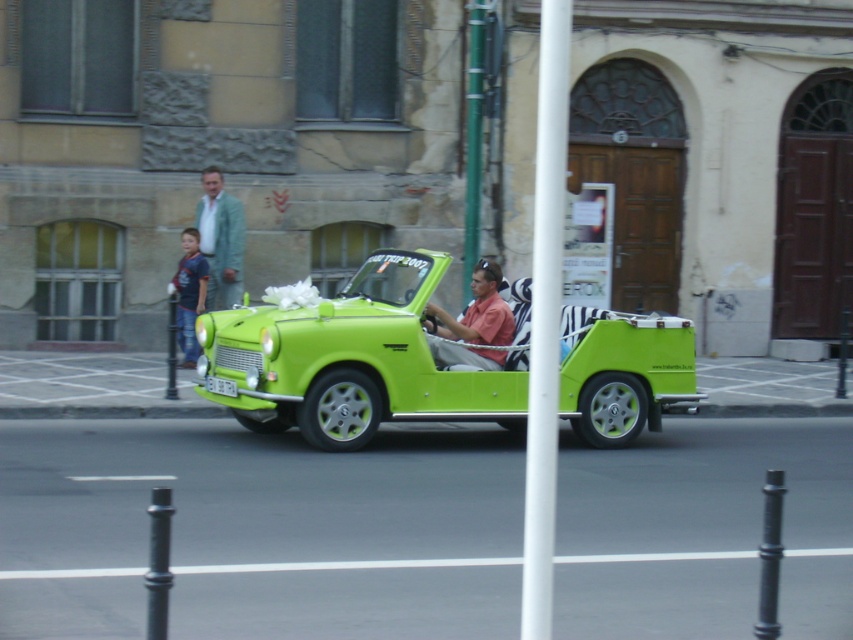
Which is in front, point (355, 314) or point (207, 198)?

Positioned in front is point (355, 314).

Does lime green plastic car at center appear on the left side of light blue fabric jacket at upper left?

In fact, lime green plastic car at center is to the right of light blue fabric jacket at upper left.

Is point (682, 403) closer to camera compared to point (207, 182)?

Yes, it is.

At what (x,y) coordinates should I click in order to perform the action: click on lime green plastic car at center. Please return your answer as a coordinate pair (x, y). The width and height of the screenshot is (853, 640). Looking at the image, I should click on coord(351,362).

Does green metallic pole at center have a lesser height compared to blue denim jeans at left?

Incorrect, green metallic pole at center's height does not fall short of blue denim jeans at left's.

Is point (473, 152) positioned before point (199, 264)?

Yes, it is.

The image size is (853, 640). What are the coordinates of `green metallic pole at center` in the screenshot? It's located at (473, 138).

In the scene shown: Does white plastic pole at center have a lesser height compared to pink matte shirt at center?

No.

Which is above, white plastic pole at center or pink matte shirt at center?

Positioned higher is white plastic pole at center.

The image size is (853, 640). Identify the location of white plastic pole at center. (544, 320).

Find the location of a particular element. white plastic pole at center is located at coordinates (544, 320).